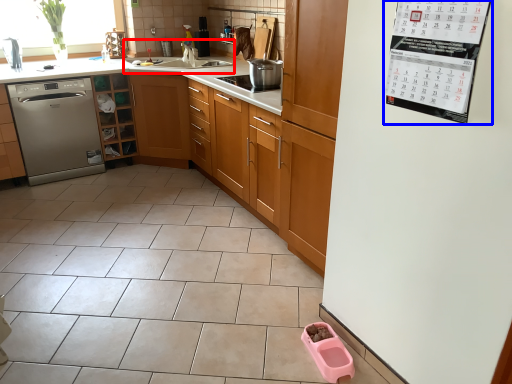
Question: Which point is further to the camera, sink (highlighted by a red box) or bulletin board (highlighted by a blue box)?

Choices:
 (A) sink
 (B) bulletin board

Answer: (A)